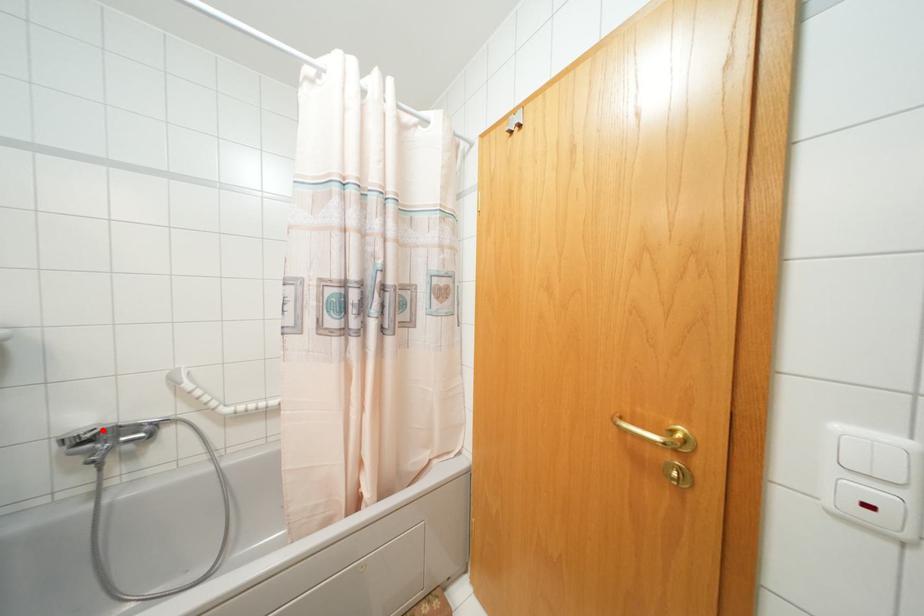
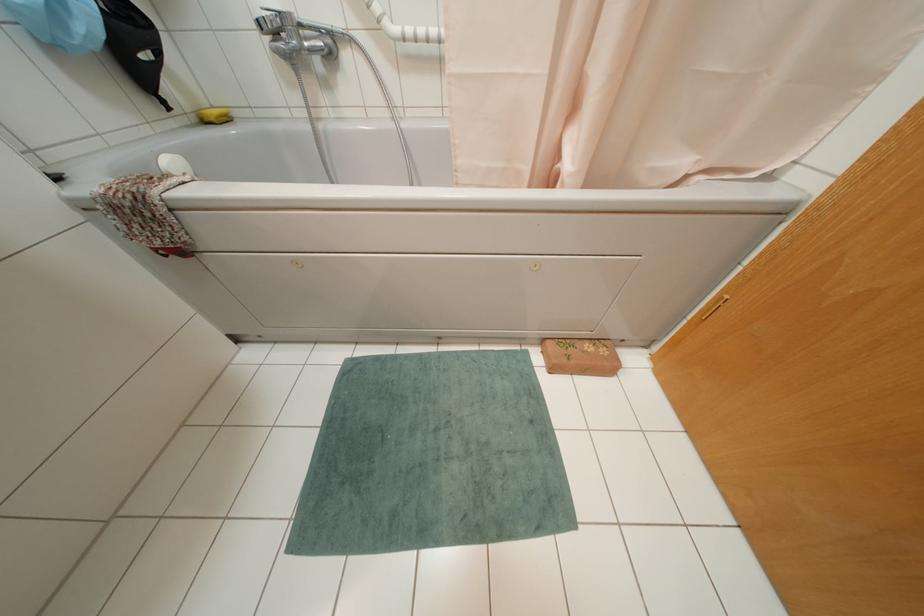
Question: I am providing you with two images of the same scene from different viewpoints. Image1 has a red point marked. In image2, the corresponding 3D location appears at what relative position? Reply with the corresponding letter.

Choices:
 (A) Closer
 (B) Farther

Answer: (B)